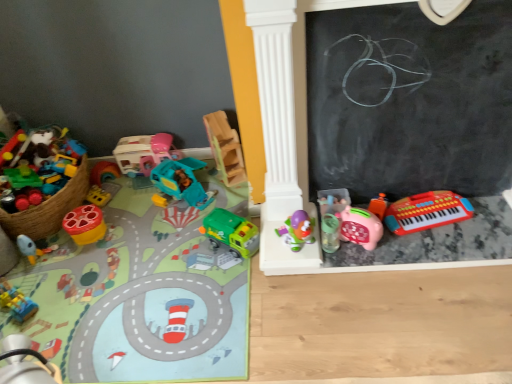
Find the location of `vacant area that is in front of matte plastic toy rocket at lower left, the first toy from the left`. vacant area that is in front of matte plastic toy rocket at lower left, the first toy from the left is located at coordinates (49, 279).